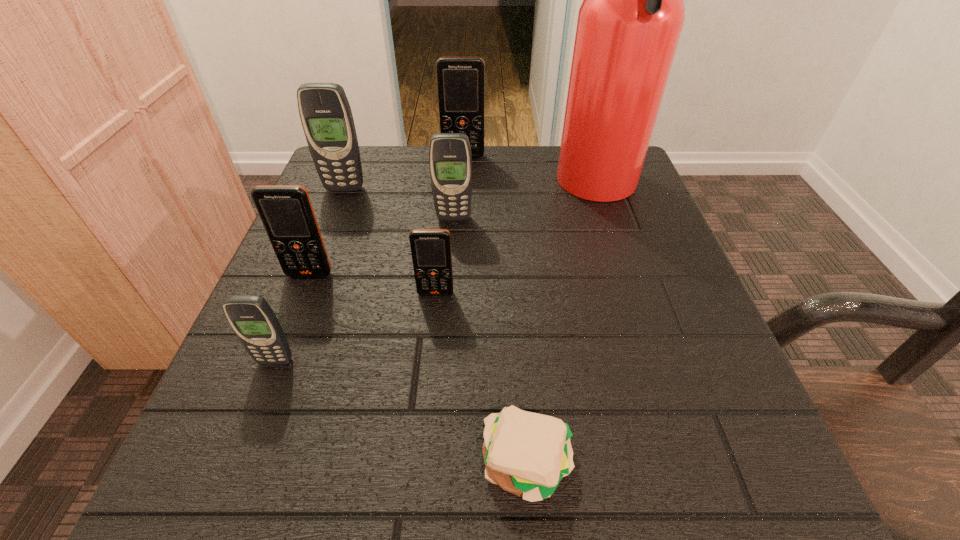
In the image, there is a desktop. At what (x,y) coordinates should I click in order to perform the action: click on free region at the near edge. Please return your answer as a coordinate pair (x, y). The height and width of the screenshot is (540, 960). Looking at the image, I should click on (643, 504).

Locate an element on the screen. This screenshot has height=540, width=960. free space at the left edge of the desktop is located at coordinates (250, 416).

Identify the location of vacant area at the right edge. This screenshot has width=960, height=540. [x=634, y=291].

At what (x,y) coordinates should I click in order to perform the action: click on vacant space at the far left corner of the desktop. Please return your answer as a coordinate pair (x, y). Looking at the image, I should click on (365, 176).

This screenshot has height=540, width=960. In order to click on vacant space at the near left corner of the desktop in this screenshot , I will do `click(324, 438)`.

Find the location of a particular element. This screenshot has height=540, width=960. free space between the farthest orange cellular telephone and the patty is located at coordinates (495, 310).

Find the location of `free space between the farthest orange cellular telephone and the fire extinguisher`. free space between the farthest orange cellular telephone and the fire extinguisher is located at coordinates (530, 172).

Locate an element on the screen. This screenshot has height=540, width=960. free space between the fifth farthest object and the farthest orange cellular telephone is located at coordinates (387, 215).

Where is `blank region between the nearest orange cellular telephone and the shortest object`? The width and height of the screenshot is (960, 540). blank region between the nearest orange cellular telephone and the shortest object is located at coordinates click(x=482, y=379).

Where is `blank region between the second nearest gray cellular telephone and the nearest object`? The image size is (960, 540). blank region between the second nearest gray cellular telephone and the nearest object is located at coordinates (491, 341).